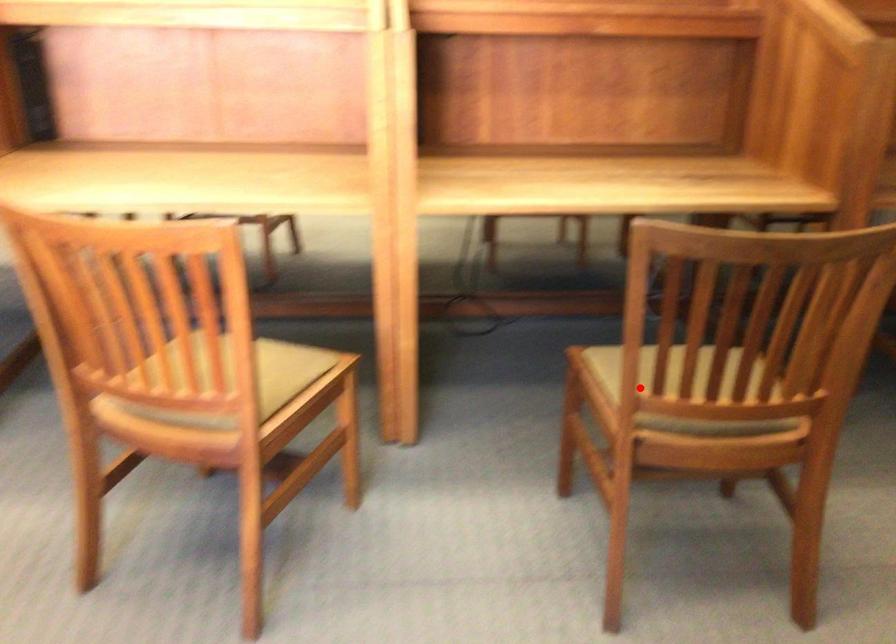
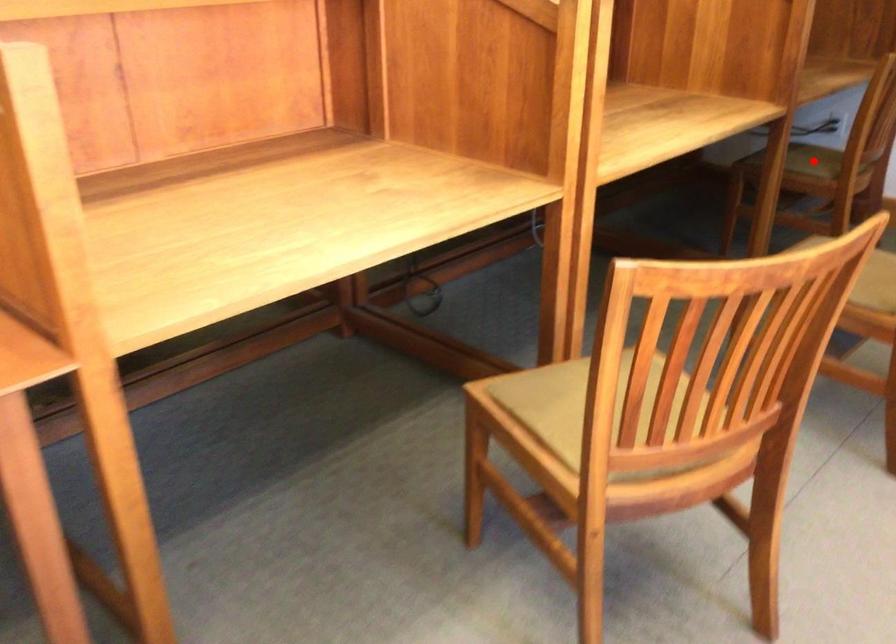
I am providing you with two images of the same scene from different viewpoints. A red point is marked on the first image and another point is marked on the second image. Is the red point in image1 aligned with the point shown in image2?

No